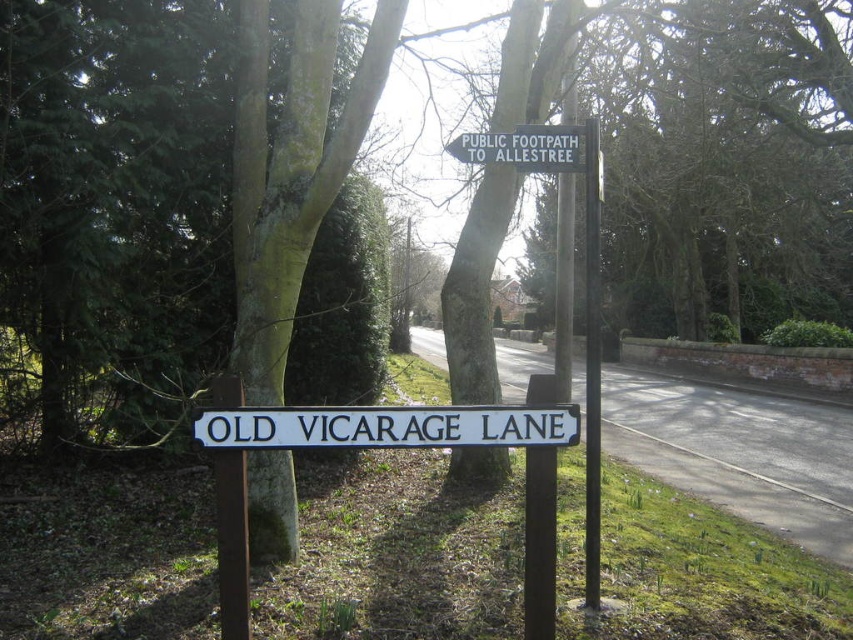
Question: Does green rough bark tree at center appear on the left side of white plastic sign at upper center?

Choices:
 (A) yes
 (B) no

Answer: (A)

Question: Which point is closer to the camera?

Choices:
 (A) (537, 140)
 (B) (102, 84)

Answer: (A)

Question: Does green rough bark tree at center appear on the left side of white plastic sign at upper center?

Choices:
 (A) yes
 (B) no

Answer: (A)

Question: Among these points, which one is farthest from the camera?

Choices:
 (A) (152, 444)
 (B) (260, 428)

Answer: (A)

Question: Which object is closer to the camera taking this photo?

Choices:
 (A) white wooden sign at center
 (B) white plastic sign at upper center

Answer: (A)

Question: In this image, where is green rough bark tree at center located relative to white plastic sign at upper center?

Choices:
 (A) above
 (B) below

Answer: (A)